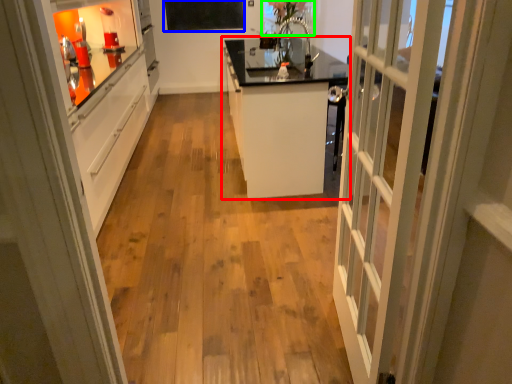
Question: Considering the real-world distances, which object is farthest from cabinetry (highlighted by a red box)? bulletin board (highlighted by a blue box) or window screen (highlighted by a green box)?

Choices:
 (A) bulletin board
 (B) window screen

Answer: (A)